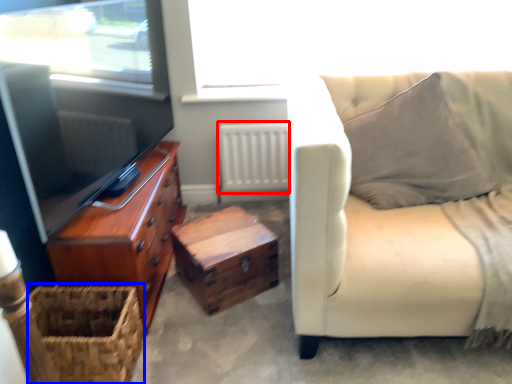
Question: Which of the following is the farthest to the observer, radiator (highlighted by a red box) or basket (highlighted by a blue box)?

Choices:
 (A) radiator
 (B) basket

Answer: (A)